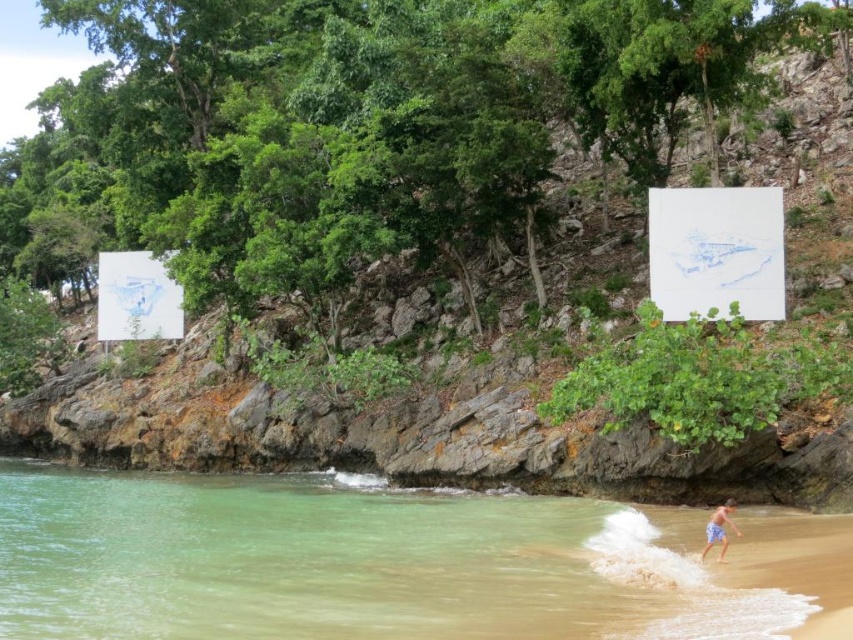
Can you confirm if clear water at beach right is wider than blue striped shorts at lower right?

Correct, the width of clear water at beach right exceeds that of blue striped shorts at lower right.

Does clear water at beach right lie behind blue striped shorts at lower right?

That is False.

Describe the element at coordinates (351, 563) in the screenshot. I see `clear water at beach right` at that location.

Where is `clear water at beach right`? Image resolution: width=853 pixels, height=640 pixels. clear water at beach right is located at coordinates (351, 563).